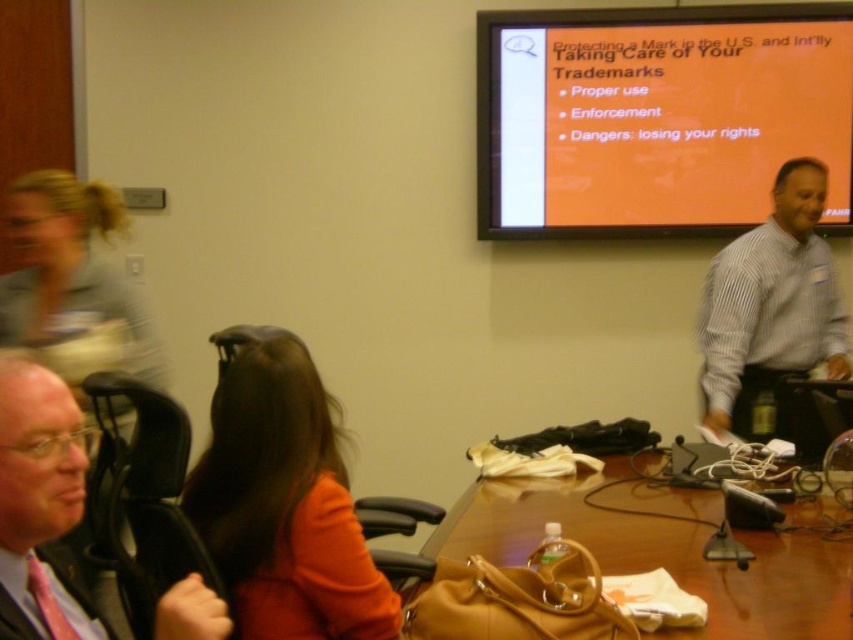
You are a photographer taking a picture of the orange fabric hair at center and the matte black chair at left. Which object will appear larger in the photo?

The orange fabric hair at center will appear larger in the photo because it is bigger than the matte black chair at left.

You are sitting in the matte black chair at left and want to reach the brown leather table at center. Which direction should you move to get there?

A: You should move to your right since the brown leather table at center is to the right of the matte black chair at left.